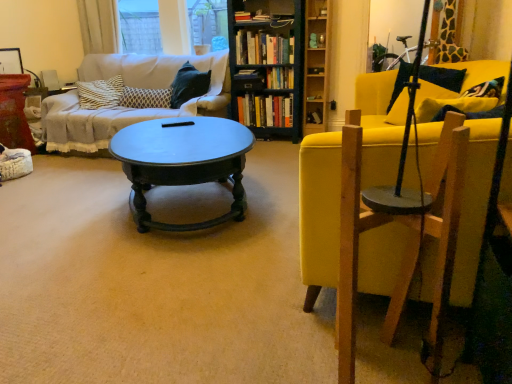
Find the location of a particular element. vacant space positioned to the left of shiny dark wood coffee table at center is located at coordinates (81, 203).